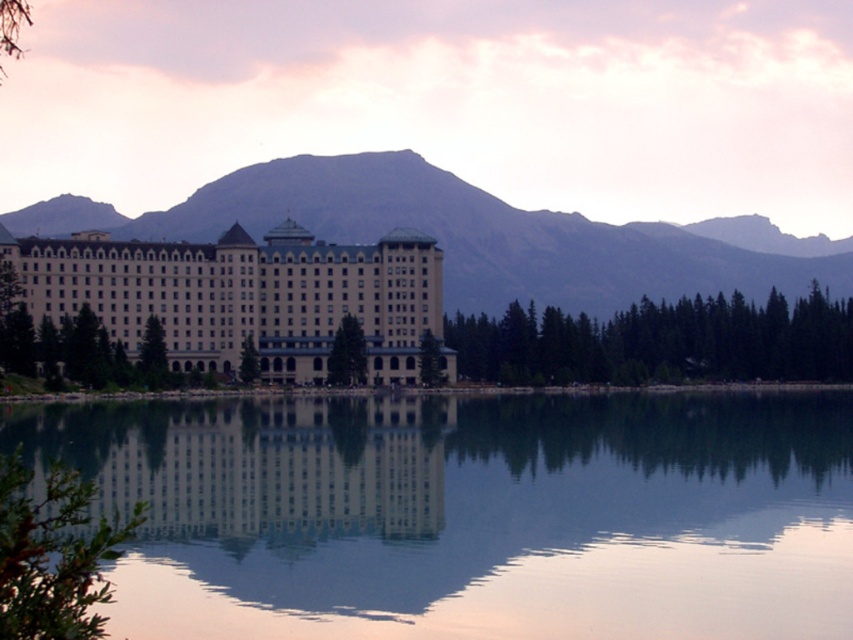
Does white glass building at center appear on the right side of beige stone hotel at center?

Indeed, white glass building at center is positioned on the right side of beige stone hotel at center.

Is white glass building at center shorter than beige stone hotel at center?

Correct, white glass building at center is not as tall as beige stone hotel at center.

Where is `white glass building at center`? The width and height of the screenshot is (853, 640). white glass building at center is located at coordinates (x=254, y=467).

How much distance is there between transparent glass water at center and beige stone hotel at center?

transparent glass water at center and beige stone hotel at center are 25.52 meters apart from each other.

Does transparent glass water at center have a lesser width compared to beige stone hotel at center?

No.

Where is `transparent glass water at center`? transparent glass water at center is located at coordinates (469, 515).

The image size is (853, 640). Find the location of `transparent glass water at center`. transparent glass water at center is located at coordinates (469, 515).

Which is in front, point (268, 440) or point (259, 417)?

Point (268, 440) is in front.

Is transparent glass water at center further to the viewer compared to white glass building at center?

No, it is not.

Consider the image. Measure the distance between transparent glass water at center and camera.

They are 81.66 meters apart.

I want to click on transparent glass water at center, so click(x=469, y=515).